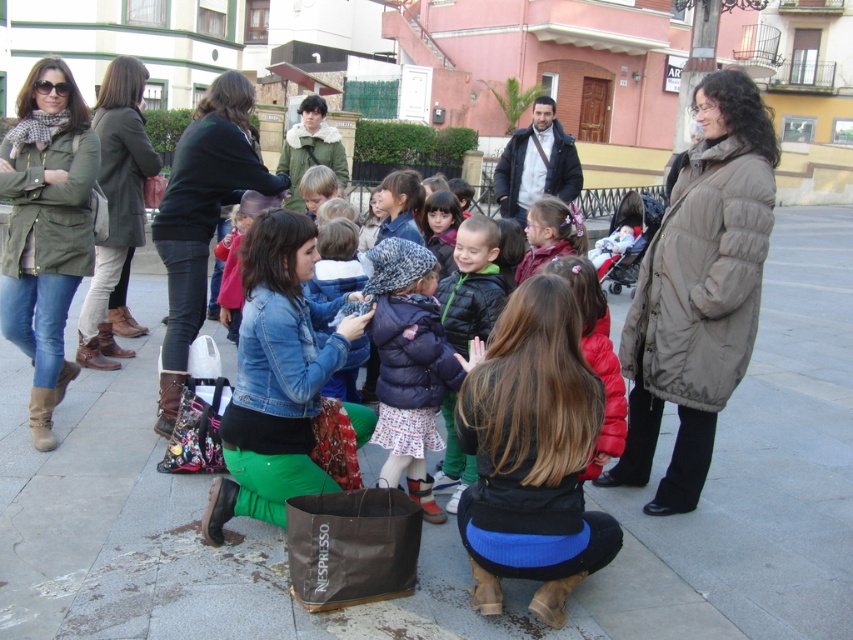
Does green textured jacket at upper left appear on the left side of green fuzzy coat at center?

Correct, you'll find green textured jacket at upper left to the left of green fuzzy coat at center.

Between green textured jacket at upper left and green fuzzy coat at center, which one has less height?

green fuzzy coat at center is shorter.

Identify the location of green textured jacket at upper left. (45, 228).

Who is higher up, green textured jacket at upper left or dark blue puffer jacket at center?

green textured jacket at upper left is above.

Is point (53, 300) farther from camera compared to point (390, 452)?

Yes, point (53, 300) is farther from viewer.

From the picture: Who is more forward, (28, 304) or (405, 353)?

Positioned in front is point (405, 353).

Identify the location of green textured jacket at upper left. The width and height of the screenshot is (853, 640). (45, 228).

Can you confirm if green textured jacket at upper left is wider than red puffer jacket at center?

Indeed, green textured jacket at upper left has a greater width compared to red puffer jacket at center.

Can you confirm if green textured jacket at upper left is bigger than red puffer jacket at center?

Correct, green textured jacket at upper left is larger in size than red puffer jacket at center.

Who is more distant from viewer, (x=76, y=115) or (x=601, y=312)?

Point (x=76, y=115)

I want to click on green textured jacket at upper left, so click(x=45, y=228).